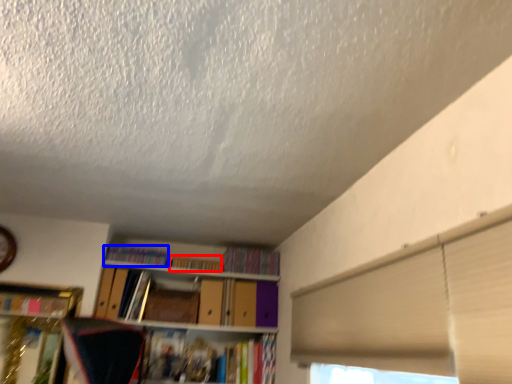
Question: Among these objects, which one is farthest to the camera, book (highlighted by a red box) or book (highlighted by a blue box)?

Choices:
 (A) book
 (B) book

Answer: (A)